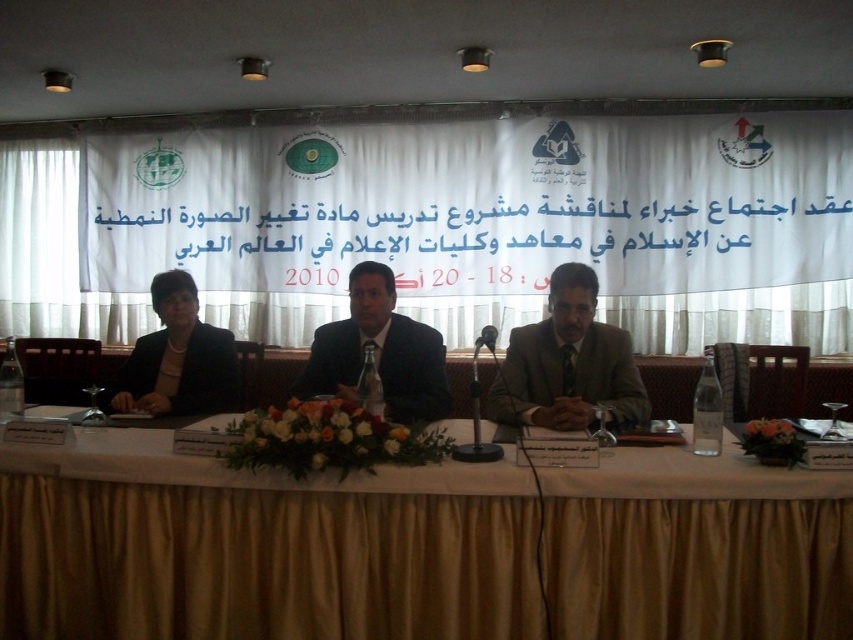
You are a photographer at the event and want to take a picture of the banner behind the panelists. You notice a point at coordinates (258, 547). Where is this point located in relation to the table?

The point at coordinates (258, 547) is located on the white fabric table at center.

You are organizing a photo shoot for a magazine and need to arrange the panelists in order of height from shortest to tallest. Given the dark blue suit at center and the black matte suit at left, which panelist should be placed first in this sequence?

The black matte suit at left should be placed first in the sequence since it is shorter than the dark blue suit at center, which is much taller.

You are a photographer setting up for a conference photo. You need to ensure that the white fabric table at center and the dark blue suit at center are both visible in the shot. Given their height difference, which object might require you to adjust your camera angle to avoid being blocked?

The white fabric table at center is taller than the dark blue suit at center, so the dark blue suit at center might be partially blocked by the table. To ensure visibility, adjust the camera angle to look slightly upwards to capture both objects clearly.